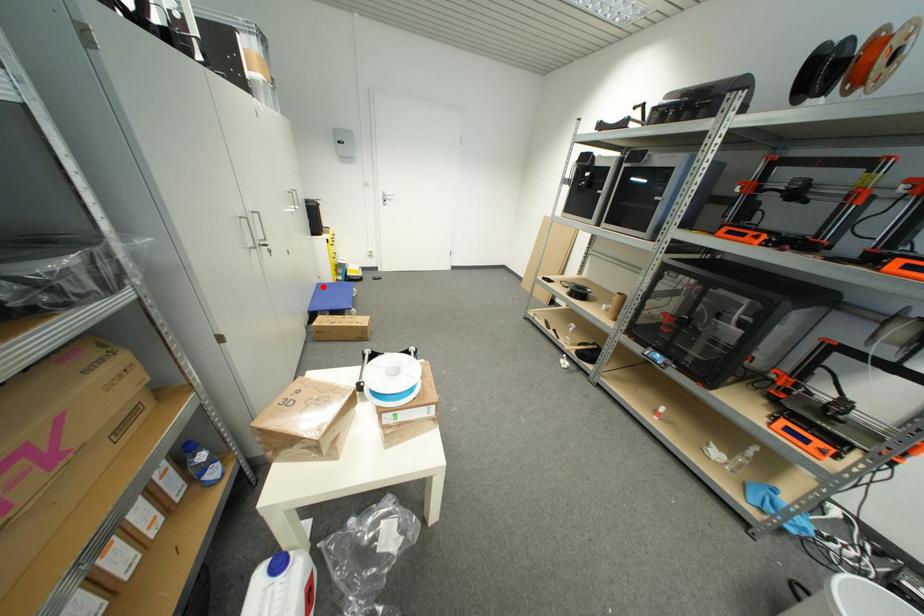
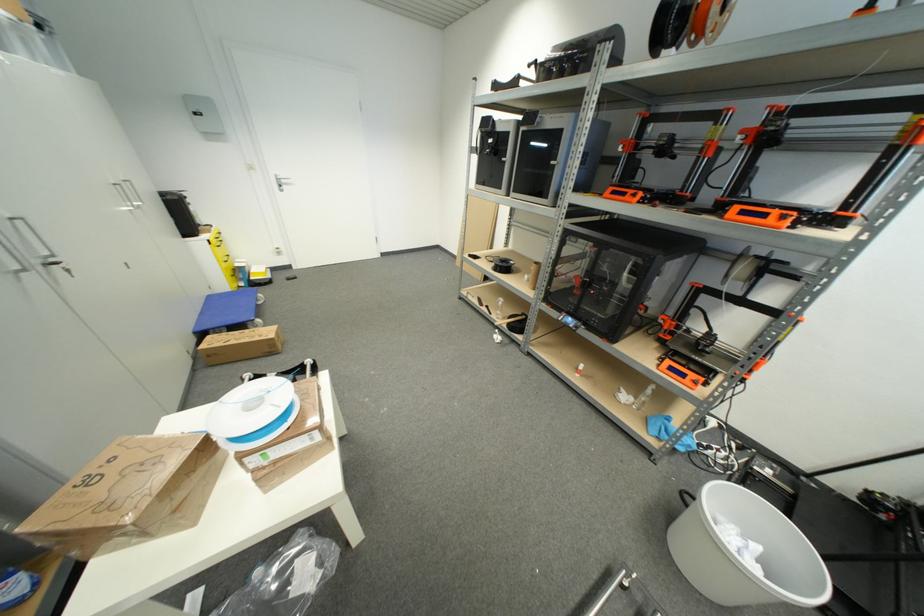
Find the pixel in the second image that matches the highlighted location in the first image.

(213, 299)